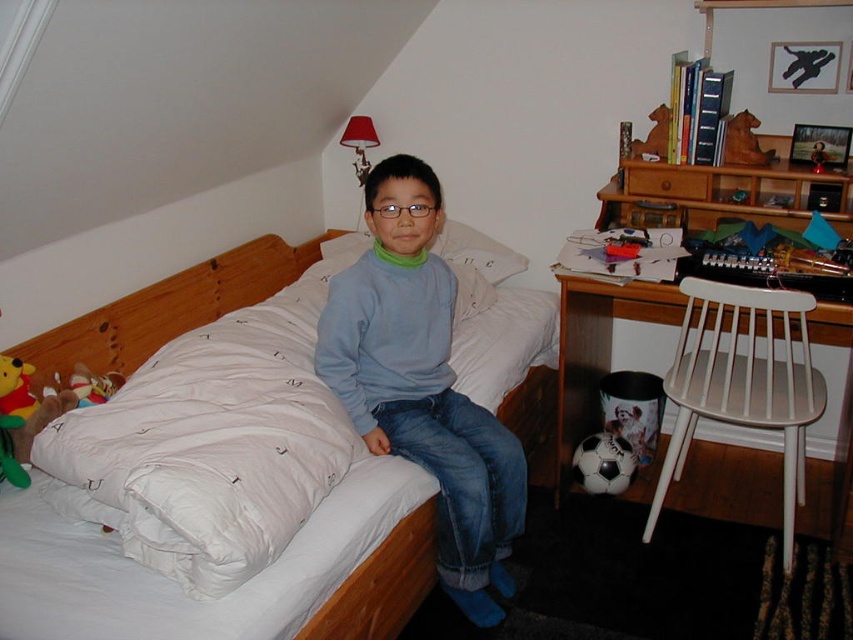
Question: Considering the real-world distances, which object is closest to the soft plush bear at bed left?

Choices:
 (A) light blue sweater at center
 (B) white soft pillow at center
 (C) white soft bed at center
 (D) white wood chair at right

Answer: (C)

Question: Can you confirm if white soft bed at center is smaller than white wood chair at right?

Choices:
 (A) yes
 (B) no

Answer: (B)

Question: Which point is farther to the camera?

Choices:
 (A) (693, 412)
 (B) (480, 234)
 (C) (204, 304)
 (D) (498, 605)

Answer: (B)

Question: Which of the following is the farthest from the observer?

Choices:
 (A) (253, 240)
 (B) (442, 404)
 (C) (521, 262)
 (D) (32, 401)

Answer: (C)

Question: Is light blue sweater at center to the right of soft plush bear at bed left from the viewer's perspective?

Choices:
 (A) yes
 (B) no

Answer: (A)

Question: Observing the image, what is the correct spatial positioning of white wood chair at right in reference to soft plush bear at bed left?

Choices:
 (A) left
 (B) right

Answer: (B)